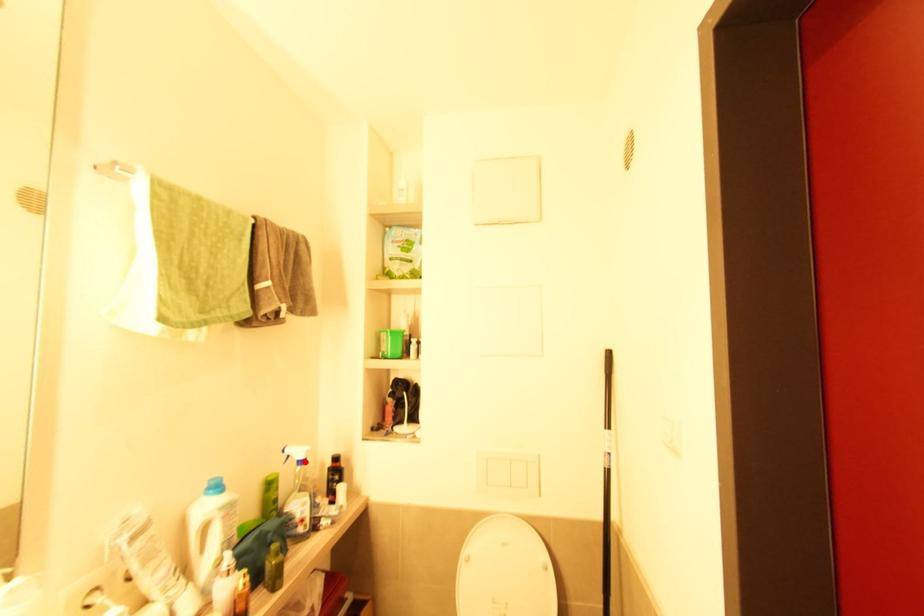
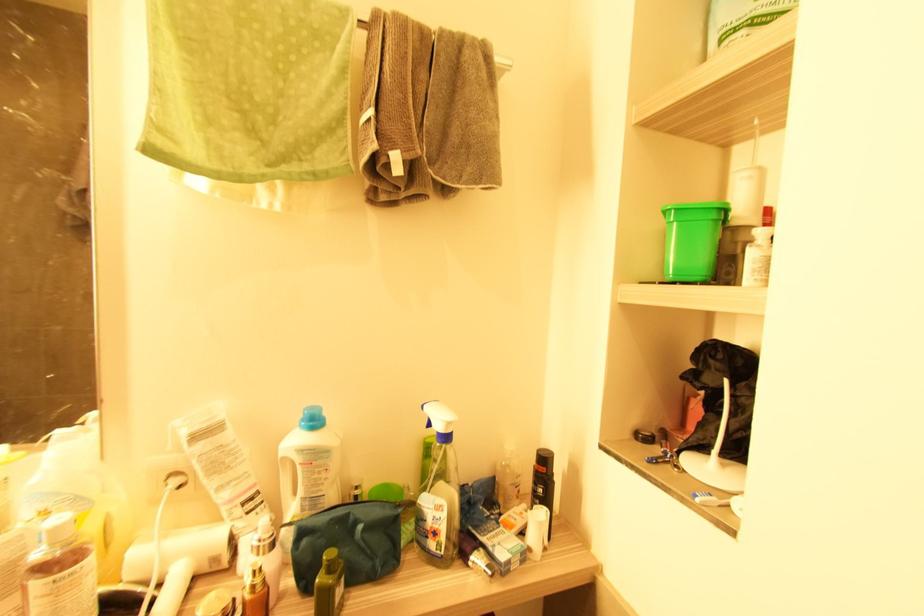
Where in the second image is the point corresponding to the highlighted location from the first image?

(447, 438)